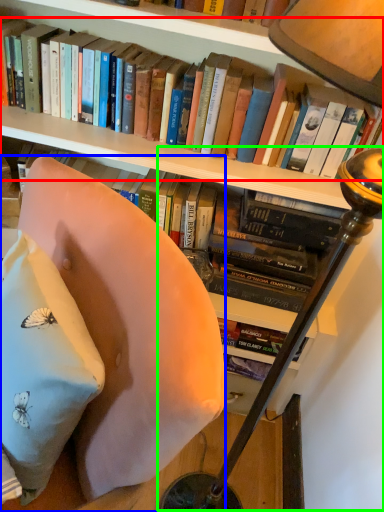
Question: Based on their relative distances, which object is nearer to book (highlighted by a red box)? Choose from chair (highlighted by a blue box) and table lamp (highlighted by a green box).

Choices:
 (A) chair
 (B) table lamp

Answer: (B)